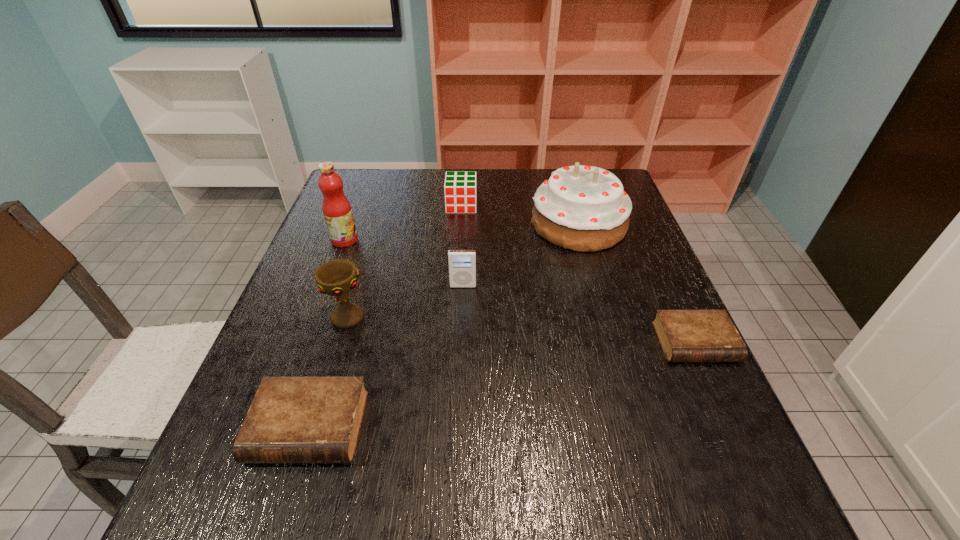
Point out which object is positioned as the nearest to the taller diary. Please provide its 2D coordinates. Your answer should be formatted as a tuple, i.e. [(x, y)], where the tuple contains the x and y coordinates of a point satisfying the conditions above.

[(338, 277)]

Locate an element on the screen. The height and width of the screenshot is (540, 960). object that stands as the fifth closest to the cube is located at coordinates (685, 335).

I want to click on vacant space that satisfies the following two spatial constraints: 1. on the red face of the cube; 2. on the right side of the cake, so click(461, 224).

Locate an element on the screen. This screenshot has width=960, height=540. vacant space that satisfies the following two spatial constraints: 1. on the front label of the tallest object; 2. on the back side of the fifth shortest object is located at coordinates (316, 317).